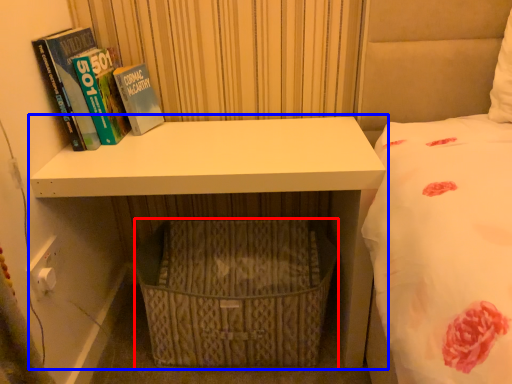
Question: Which of the following is the farthest to the observer, basket (highlighted by a red box) or shelf (highlighted by a blue box)?

Choices:
 (A) basket
 (B) shelf

Answer: (A)